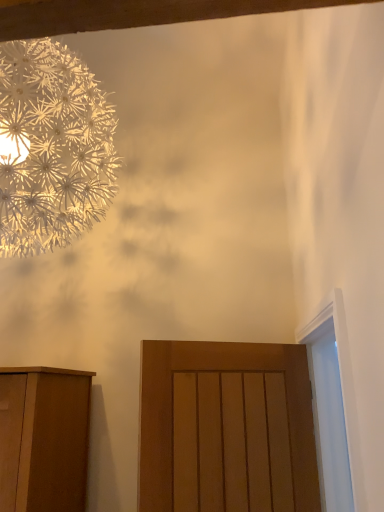
Based on the photo, what is the approximate width of metallic silver flower at upper left?

It is 35.35 inches.

Where is `white glossy door at right`? This screenshot has height=512, width=384. white glossy door at right is located at coordinates (333, 406).

What do you see at coordinates (333, 406) in the screenshot?
I see `white glossy door at right` at bounding box center [333, 406].

Image resolution: width=384 pixels, height=512 pixels. Find the location of `matte wood door at center`. matte wood door at center is located at coordinates click(226, 428).

Which object is further away from the camera, metallic silver flower at upper left or white glossy door at right?

metallic silver flower at upper left is further away from the camera.

How many degrees apart are the facing directions of metallic silver flower at upper left and white glossy door at right?

0.151 degrees separate the facing orientations of metallic silver flower at upper left and white glossy door at right.

Is metallic silver flower at upper left not near white glossy door at right?

That's right, there is a large distance between metallic silver flower at upper left and white glossy door at right.

Identify the location of door below the metallic silver flower at upper left (from the image's perspective). (226, 428).

Does matte wood door at center have a greater width compared to metallic silver flower at upper left?

Incorrect, the width of matte wood door at center does not surpass that of metallic silver flower at upper left.

Based on their sizes in the image, would you say matte wood door at center is bigger or smaller than metallic silver flower at upper left?

Clearly, matte wood door at center is smaller in size than metallic silver flower at upper left.

Is matte wood door at center not inside metallic silver flower at upper left?

matte wood door at center lies outside metallic silver flower at upper left's area.

Considering the relative sizes of metallic silver flower at upper left and matte wood door at center in the image provided, is metallic silver flower at upper left thinner than matte wood door at center?

No, metallic silver flower at upper left is not thinner than matte wood door at center.

Does metallic silver flower at upper left contain matte wood door at center?

No, matte wood door at center is not surrounded by metallic silver flower at upper left.

Looking at this image, considering the relative sizes of metallic silver flower at upper left and matte wood door at center in the image provided, is metallic silver flower at upper left smaller than matte wood door at center?

No.

Can you confirm if metallic silver flower at upper left is positioned to the left of matte wood door at center?

Correct, you'll find metallic silver flower at upper left to the left of matte wood door at center.

Are white glossy door at right and metallic silver flower at upper left located far from each other?

Yes, white glossy door at right and metallic silver flower at upper left are quite far apart.

Is white glossy door at right not within metallic silver flower at upper left?

Yes, white glossy door at right is outside of metallic silver flower at upper left.

From the image's perspective, is white glossy door at right on top of metallic silver flower at upper left?

No, from the image's perspective, white glossy door at right is not above metallic silver flower at upper left.

Measure the distance from white glossy door at right to metallic silver flower at upper left.

white glossy door at right is 1.09 meters from metallic silver flower at upper left.

Does matte wood door at center have a smaller size compared to white glossy door at right?

Yes.

Based on the photo, is matte wood door at center directly adjacent to white glossy door at right?

matte wood door at center and white glossy door at right are not in contact.

Does point (149, 432) come in front of point (325, 349)?

Yes, it is in front of point (325, 349).

From the picture: From a real-world perspective, which object stands above the other?

From a 3D spatial view, white glossy door at right is above.

In the scene shown: Can you tell me how much white glossy door at right and matte wood door at center differ in facing direction?

The facing directions of white glossy door at right and matte wood door at center are 116 degrees apart.

Consider the image. Is white glossy door at right far from matte wood door at center?

white glossy door at right is near matte wood door at center, not far away.

Considering the relative sizes of white glossy door at right and matte wood door at center in the image provided, is white glossy door at right bigger than matte wood door at center?

Correct, white glossy door at right is larger in size than matte wood door at center.

Is white glossy door at right positioned beyond the bounds of matte wood door at center?

Yes, white glossy door at right is located beyond the bounds of matte wood door at center.

Identify the location of flower above the white glossy door at right (from the image's perspective). The height and width of the screenshot is (512, 384). (51, 147).

In order to click on door that is below the metallic silver flower at upper left (from the image's perspective) in this screenshot , I will do `click(226, 428)`.

Based on their spatial positions, is matte wood door at center or metallic silver flower at upper left further from white glossy door at right?

Among the two, metallic silver flower at upper left is located further to white glossy door at right.

Estimate the real-world distances between objects in this image. Which object is further from white glossy door at right, metallic silver flower at upper left or matte wood door at center?

metallic silver flower at upper left lies further to white glossy door at right than the other object.

Estimate the real-world distances between objects in this image. Which object is further from matte wood door at center, metallic silver flower at upper left or white glossy door at right?

metallic silver flower at upper left is positioned further to the anchor matte wood door at center.

When comparing their distances from matte wood door at center, does white glossy door at right or metallic silver flower at upper left seem closer?

Based on the image, white glossy door at right appears to be nearer to matte wood door at center.

Looking at the image, which one is located closer to metallic silver flower at upper left, white glossy door at right or matte wood door at center?

matte wood door at center is positioned closer to the anchor metallic silver flower at upper left.

Looking at the image, which one is located closer to metallic silver flower at upper left, matte wood door at center or white glossy door at right?

matte wood door at center.

Find the location of a particular element. This screenshot has width=384, height=512. window between metallic silver flower at upper left and matte wood door at center in the up-down direction is located at coordinates (333, 406).